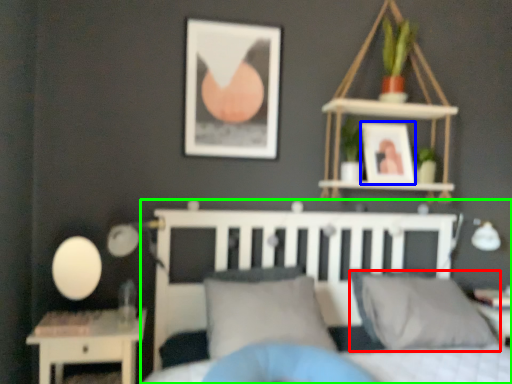
Question: Which object is the closest to the pillow (highlighted by a red box)? Choose among these: picture frame (highlighted by a blue box) or bed (highlighted by a green box).

Choices:
 (A) picture frame
 (B) bed

Answer: (B)